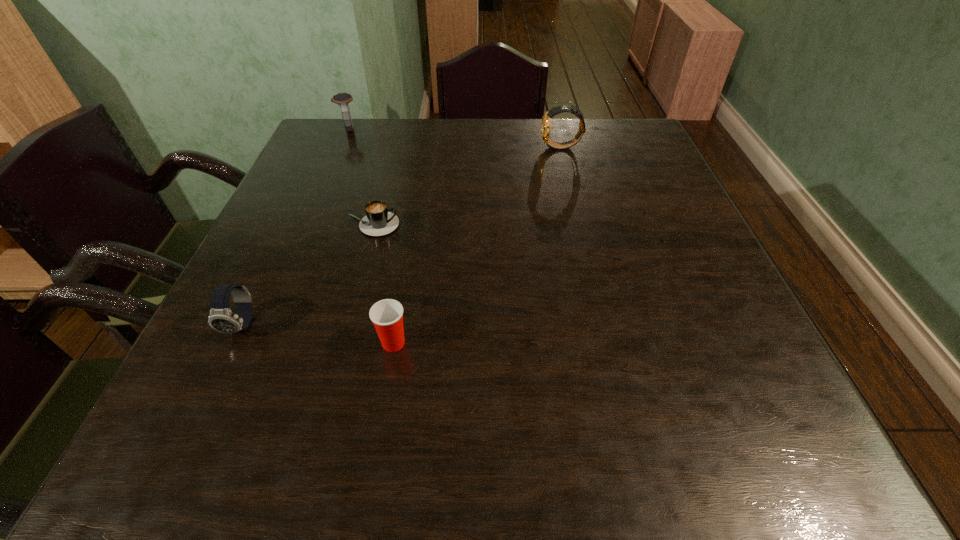
Identify the location of free space between the fourth nearest object and the nearest watch. This screenshot has height=540, width=960. (402, 236).

This screenshot has height=540, width=960. What are the coordinates of `vacant area that lies between the third farthest object and the second object from right to left` in the screenshot? It's located at (383, 284).

Locate an element on the screen. The image size is (960, 540). vacant point located between the rightmost watch and the nearest watch is located at coordinates (402, 236).

The height and width of the screenshot is (540, 960). I want to click on free spot between the tallest watch and the nearest watch, so click(402, 236).

Find the location of `free space between the nearest watch and the second object from right to left`. free space between the nearest watch and the second object from right to left is located at coordinates (318, 334).

Where is `vacant area between the farthest watch and the nearest watch`? The width and height of the screenshot is (960, 540). vacant area between the farthest watch and the nearest watch is located at coordinates (296, 227).

I want to click on free spot between the fourth object from left to right and the farthest watch, so (372, 236).

At what (x,y) coordinates should I click in order to perform the action: click on empty location between the third object from left to right and the farthest object. Please return your answer as a coordinate pair (x, y). This screenshot has height=540, width=960. Looking at the image, I should click on (360, 177).

Image resolution: width=960 pixels, height=540 pixels. I want to click on unoccupied area between the Dixie cup and the nearest watch, so click(x=318, y=334).

Image resolution: width=960 pixels, height=540 pixels. Find the location of `unoccupied position between the farthest watch and the Dixie cup`. unoccupied position between the farthest watch and the Dixie cup is located at coordinates (372, 236).